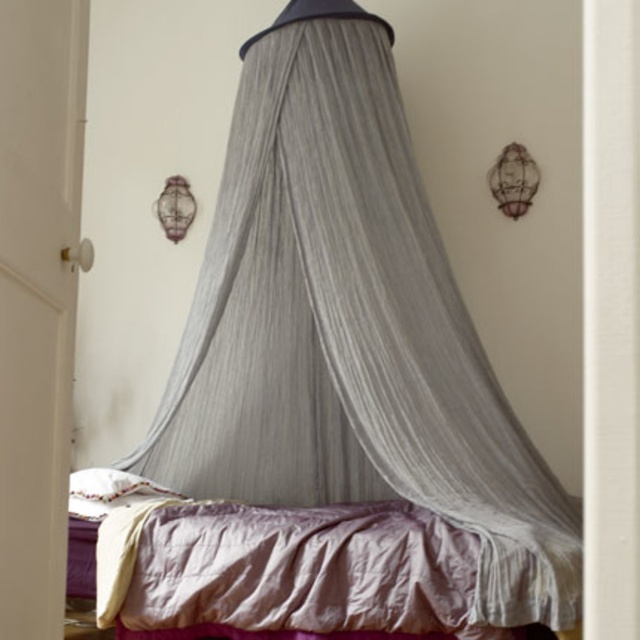
Question: Is gray fabric canopy at upper center above silky purple bed at center?

Choices:
 (A) yes
 (B) no

Answer: (A)

Question: Is gray fabric canopy at upper center smaller than silky purple bed at center?

Choices:
 (A) yes
 (B) no

Answer: (B)

Question: Which point is farther to the camera?

Choices:
 (A) (152, 554)
 (B) (385, 392)

Answer: (B)

Question: Which point is farther from the camera taking this photo?

Choices:
 (A) (388, 408)
 (B) (172, 515)

Answer: (B)

Question: Is gray fabric canopy at upper center in front of silky purple bed at center?

Choices:
 (A) no
 (B) yes

Answer: (B)